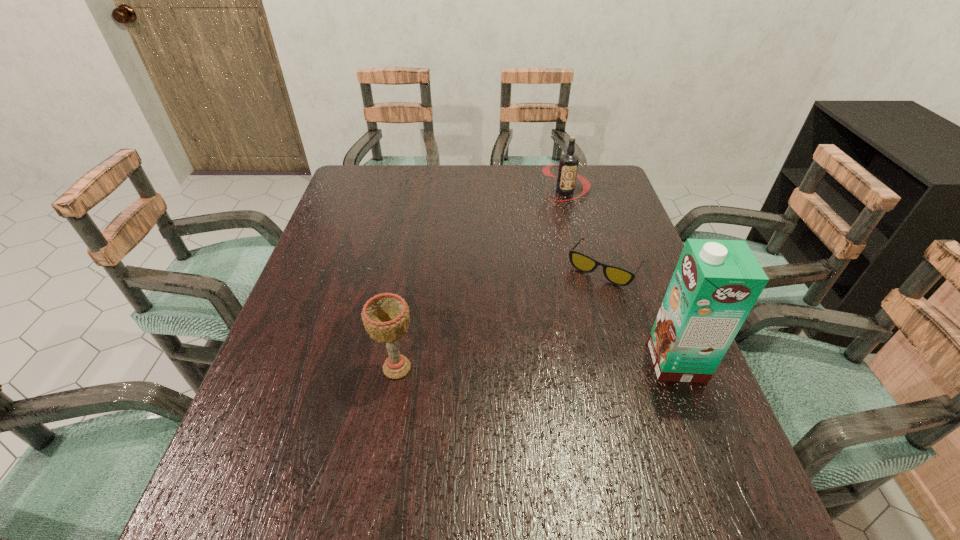
Locate an element on the screen. chalice is located at coordinates (386, 318).

Where is `carton`? Image resolution: width=960 pixels, height=540 pixels. carton is located at coordinates (716, 283).

Image resolution: width=960 pixels, height=540 pixels. I want to click on the third nearest object, so click(619, 276).

In order to click on the shortest object in this screenshot , I will do `click(619, 276)`.

Find the location of `root beer`. root beer is located at coordinates (568, 165).

In order to click on vacant area located on the back of the leftmost object in this screenshot , I will do `click(410, 288)`.

Where is `vacant area situated 0.310m on the back of the carton`? This screenshot has height=540, width=960. vacant area situated 0.310m on the back of the carton is located at coordinates (634, 253).

Where is `vacant space located on the front-facing side of the shortest object`? This screenshot has height=540, width=960. vacant space located on the front-facing side of the shortest object is located at coordinates (581, 299).

This screenshot has height=540, width=960. What are the coordinates of `vacant area located 0.400m on the front-facing side of the shortest object` in the screenshot? It's located at (511, 405).

The width and height of the screenshot is (960, 540). Identify the location of vacant space situated on the front-facing side of the shortest object. (520, 390).